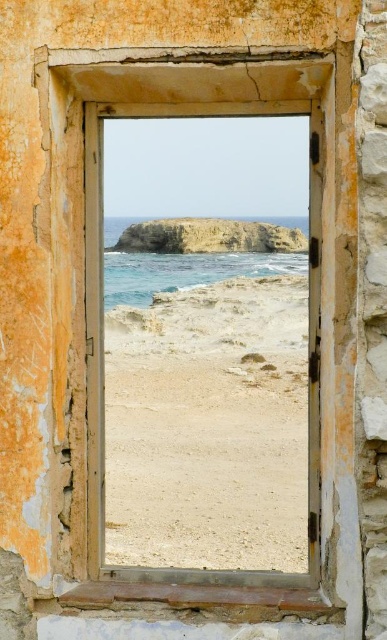
Looking at this image, you are an art student observing the image. You notice the beige sandy beach at center and the rusty metal window frame at center. Which object appears closer to you in the scene?

The rusty metal window frame at center appears closer to you because it is in front of the beige sandy beach at center, which is further away.

You are a painter standing in front of the stone wall. You want to paint the beige sandy beach at center and the rusty metal window frame at center. Which object will require more vertical canvas space due to its height?

The beige sandy beach at center has a greater height compared to the rusty metal window frame at center, so it will require more vertical canvas space.

You are standing in front of the ruined window frame and looking at the coastal view. There are two points marked on the scene, point 1 at coordinates point (275,289) and point 2 at coordinates point (328,148). Which point is closer to you?

Point (275,289) is closer to you because it is further to the viewer than point (328,148).